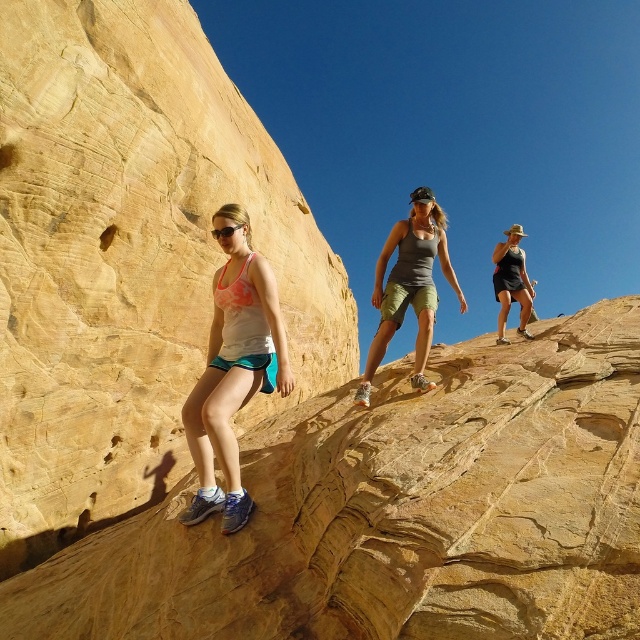
Question: Observing the image, what is the correct spatial positioning of yellow sandstone rock face at left in reference to white matte tank top at center?

Choices:
 (A) left
 (B) right

Answer: (A)

Question: Considering the relative positions of yellow sandstone rock face at left and white matte tank top at center in the image provided, where is yellow sandstone rock face at left located with respect to white matte tank top at center?

Choices:
 (A) left
 (B) right

Answer: (A)

Question: Estimate the real-world distances between objects in this image. Which object is farther from the yellow sandstone rock face at left?

Choices:
 (A) matte black tank top at upper right
 (B) white matte tank top at center
 (C) gray fabric tank top at center

Answer: (A)

Question: In this image, where is yellow sandstone rock face at left located relative to matte black tank top at upper right?

Choices:
 (A) below
 (B) above

Answer: (A)

Question: Which object is closer to the camera taking this photo?

Choices:
 (A) yellow sandstone rock face at left
 (B) gray fabric tank top at center

Answer: (A)

Question: Which point appears farthest from the camera in this image?

Choices:
 (A) (420, 323)
 (B) (68, 381)
 (C) (237, 216)
 (D) (496, 275)

Answer: (D)